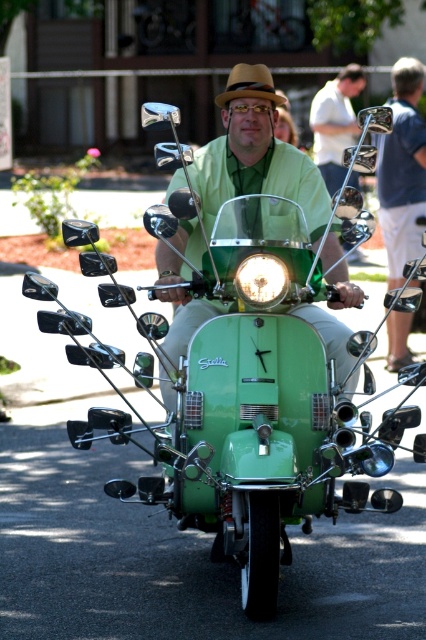
Between green matte scooter at center and matte green headlight at center, which one appears on the left side from the viewer's perspective?

green matte scooter at center is more to the left.

Between green matte scooter at center and matte green headlight at center, which one is positioned higher?

Positioned higher is green matte scooter at center.

What do you see at coordinates (256, 166) in the screenshot? I see `green matte scooter at center` at bounding box center [256, 166].

Locate an element on the screen. The image size is (426, 640). green matte scooter at center is located at coordinates (256, 166).

Does green matte scooter at center have a lesser width compared to matte green scooter at center?

In fact, green matte scooter at center might be wider than matte green scooter at center.

Does point (215, 177) come closer to viewer compared to point (340, 106)?

Yes, it is.

Locate an element on the screen. green matte scooter at center is located at coordinates (256, 166).

I want to click on green matte scooter at center, so click(x=256, y=166).

Which is more to the right, green matte scooter at center or brown felt fedora at center?

brown felt fedora at center

Based on the photo, can you confirm if green matte scooter at center is wider than brown felt fedora at center?

Yes, green matte scooter at center is wider than brown felt fedora at center.

Who is more forward, (316, 224) or (259, 68)?

Positioned in front is point (316, 224).

Locate an element on the screen. The image size is (426, 640). green matte scooter at center is located at coordinates (256, 166).